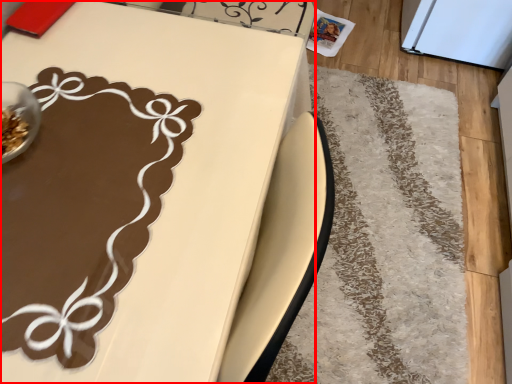
Question: Considering the relative positions of table (annotated by the red box) and mat in the image provided, where is table (annotated by the red box) located with respect to the staircase?

Choices:
 (A) left
 (B) right

Answer: (A)